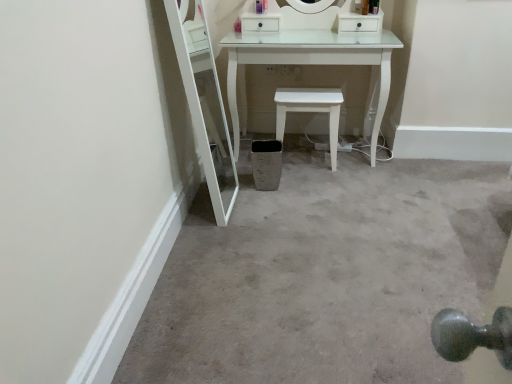
Find the location of a particular element. This screenshot has width=512, height=384. white matte stool at center is located at coordinates (310, 110).

In order to face white matte stool at center, should I rotate leftwards or rightwards?

It's best to rotate right around 6.710 degrees.

The width and height of the screenshot is (512, 384). Describe the element at coordinates (310, 110) in the screenshot. I see `white matte stool at center` at that location.

Identify the location of white matte stool at center. (310, 110).